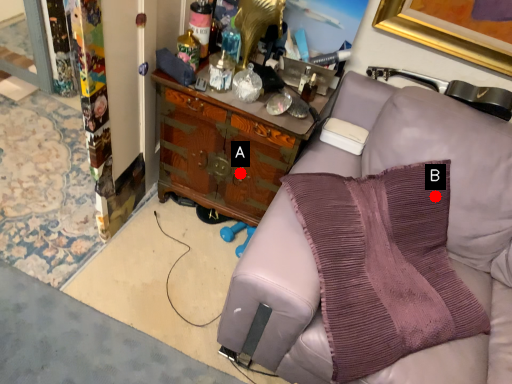
Question: Two points are circled on the image, labeled by A and B beside each circle. Which of the following is the farthest from the observer?

Choices:
 (A) A is further
 (B) B is further

Answer: (A)